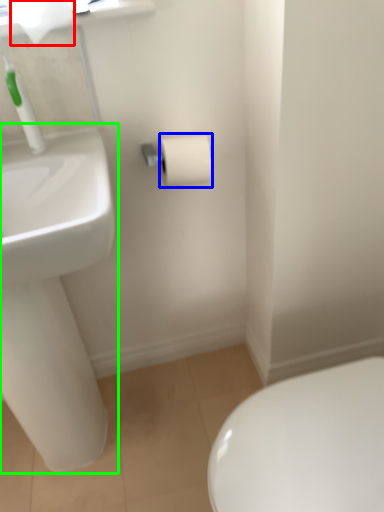
Question: Based on their relative distances, which object is nearer to toilet paper (highlighted by a red box)? Choose from toilet paper (highlighted by a blue box) and sink (highlighted by a green box).

Choices:
 (A) toilet paper
 (B) sink

Answer: (A)